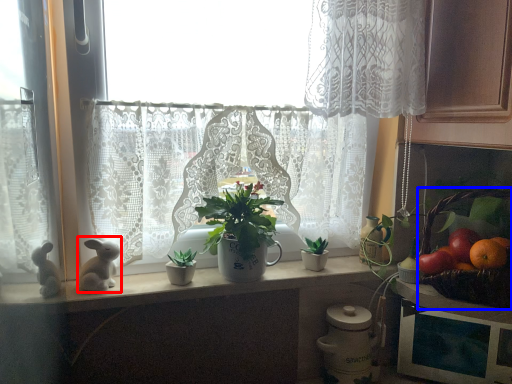
Question: Among these objects, which one is nearest to the camera, animal (highlighted by a red box) or basket (highlighted by a blue box)?

Choices:
 (A) animal
 (B) basket

Answer: (B)